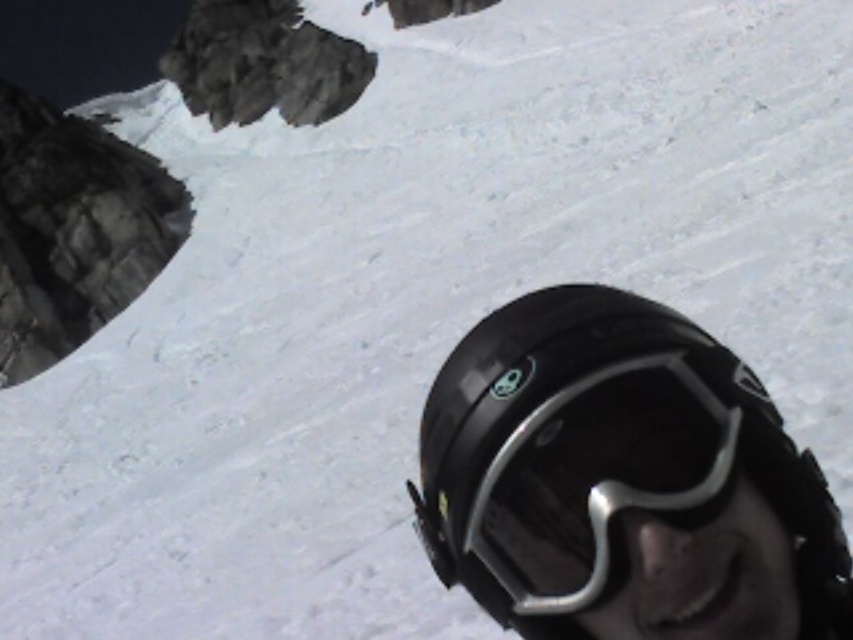
You are a photographer trying to capture the snowy landscape through the visor of the black matte helmet at lower right and the black matte goggles at lower right. Which object will allow you to see the background more clearly?

The black matte goggles at lower right will allow you to see the background more clearly because they are smaller than the black matte helmet at lower right, providing a less obstructive view.

You are a snowboarder looking at the scene. You see a point at coordinates (622, 481). Where is this point located?

The point at coordinates (622, 481) is located on the black matte helmet at lower right.